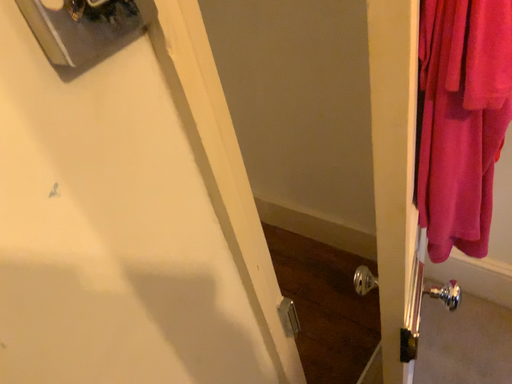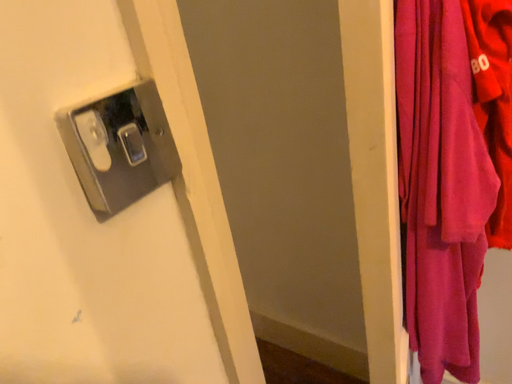
Question: How did the camera likely rotate when shooting the video?

Choices:
 (A) rotated upward
 (B) rotated downward

Answer: (A)